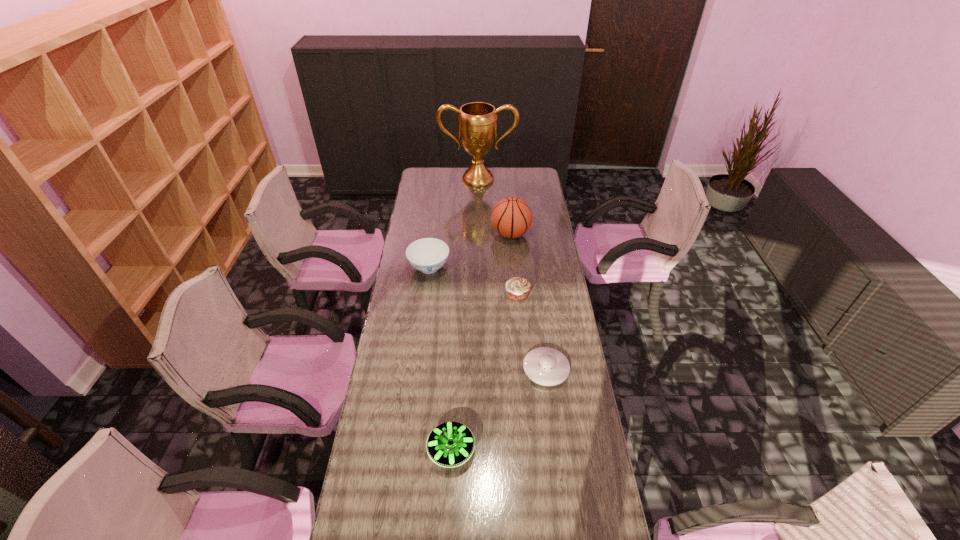
Identify the location of chinaware situated at the left edge. The image size is (960, 540). (427, 255).

Where is `trophy cup positioned at the right edge`? Image resolution: width=960 pixels, height=540 pixels. trophy cup positioned at the right edge is located at coordinates (477, 124).

You are a GUI agent. You are given a task and a screenshot of the screen. Output one action in this format:
    pyautogui.click(x=<x>, y=<y>)
    Task: Click on the basketball located at the right edge
    Image resolution: width=960 pixels, height=540 pixels.
    Given the screenshot: What is the action you would take?
    pyautogui.click(x=511, y=217)

Identify the location of muffin situated at the right edge. This screenshot has width=960, height=540. (518, 289).

Where is `saucer at the right edge`? The image size is (960, 540). saucer at the right edge is located at coordinates (546, 366).

The height and width of the screenshot is (540, 960). Find the location of `object at the far left corner`. object at the far left corner is located at coordinates (477, 124).

At what (x,y) coordinates should I click in order to perform the action: click on object located at the far right corner. Please return your answer as a coordinate pair (x, y). This screenshot has height=540, width=960. Looking at the image, I should click on (477, 124).

The height and width of the screenshot is (540, 960). Identify the location of free spot at the far edge of the desktop. (495, 177).

I want to click on blank space at the left edge, so click(x=439, y=194).

In the image, there is a desktop. Identify the location of blank space at the right edge. The height and width of the screenshot is (540, 960). (561, 451).